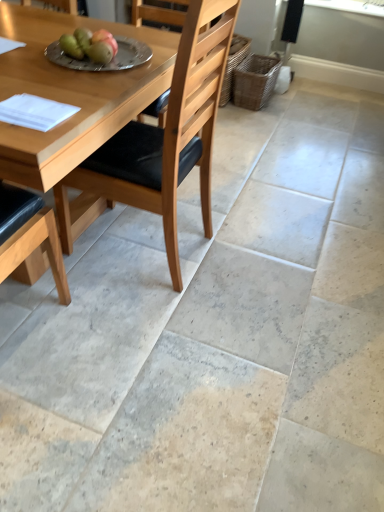
The height and width of the screenshot is (512, 384). In order to click on vacant area that lies to the right of light brown wood chair at center in this screenshot , I will do `click(240, 260)`.